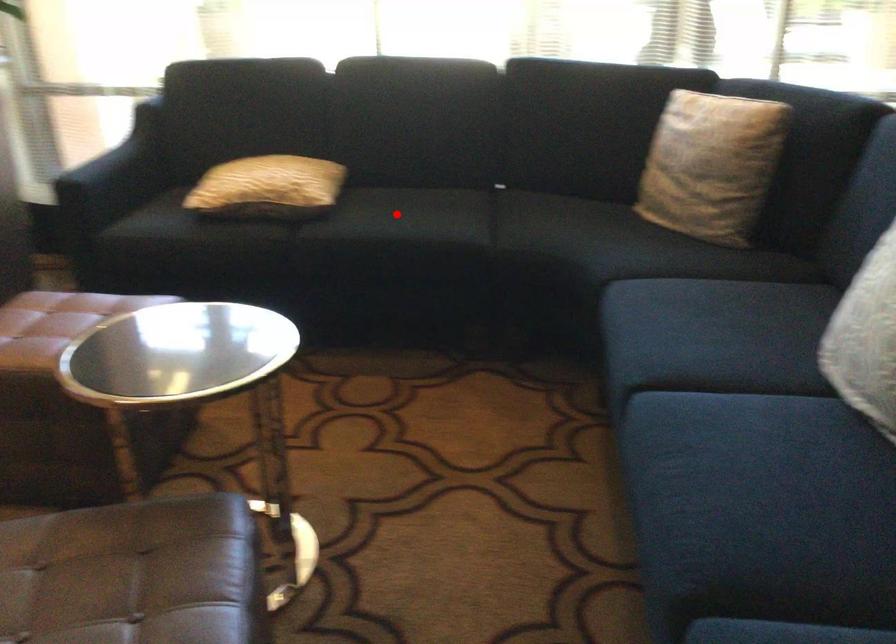
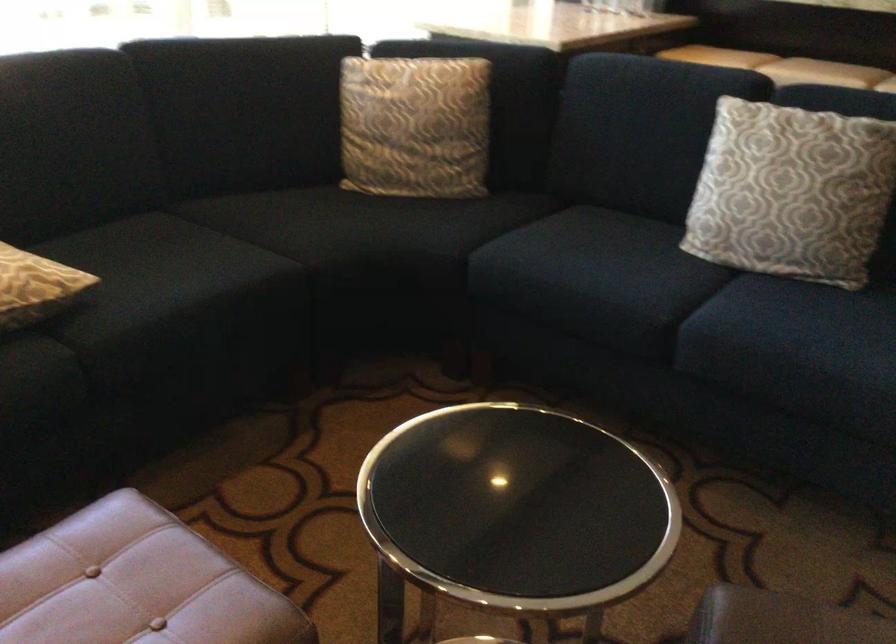
In the second image, find the point that corresponds to the highlighted location in the first image.

(161, 270)